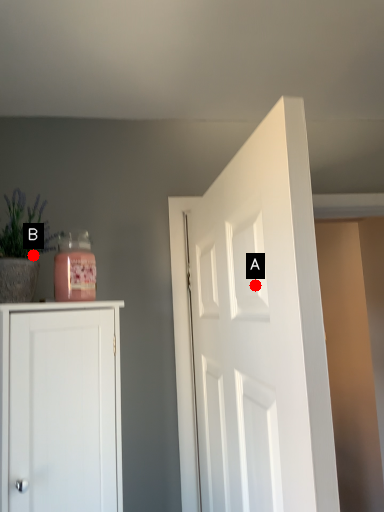
Question: Two points are circled on the image, labeled by A and B beside each circle. Which point appears closest to the camera in this image?

Choices:
 (A) A is closer
 (B) B is closer

Answer: (A)